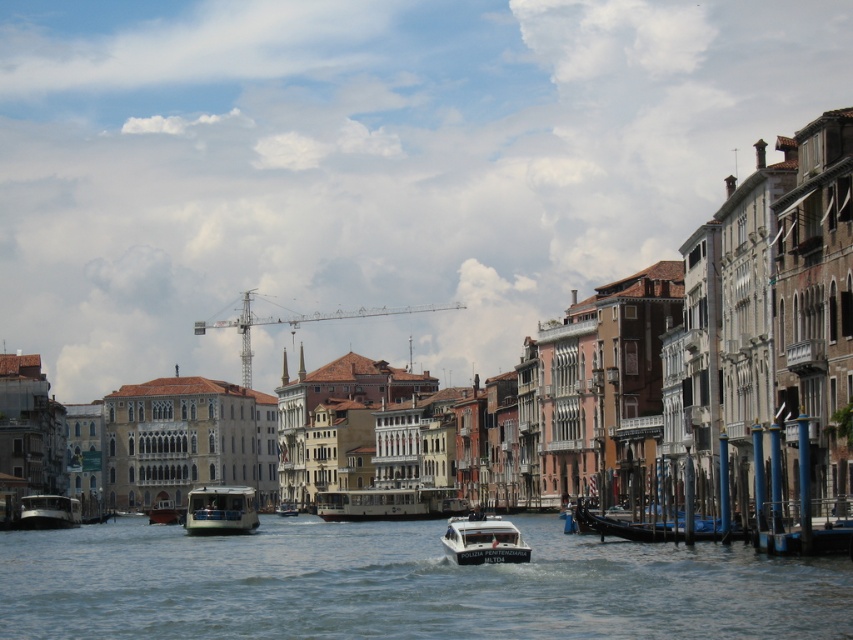
You are a tourist standing on the canal bridge and want to take a photo of the clear water at center and the metallic silver boat at center. Which object should you focus on first if you want to capture both in one shot?

The clear water at center is above the metallic silver boat at center, so you should focus on the metallic silver boat at center first to ensure both are in focus.